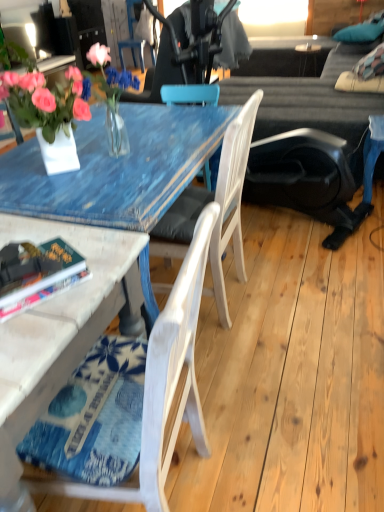
Question: From a real-world perspective, is dark gray fabric couch at upper right positioned above or below translucent glass vase at upper left?

Choices:
 (A) below
 (B) above

Answer: (A)

Question: Does point (292, 87) appear closer or farther from the camera than point (102, 82)?

Choices:
 (A) closer
 (B) farther

Answer: (B)

Question: Estimate the real-world distances between objects in this image. Which object is farther from the matte white side table at lower right?

Choices:
 (A) teal fabric pillow at upper right
 (B) white wood chair at center, which is the 2th chair from bottom to top
 (C) hardcover book at lower left
 (D) white wood chair at lower left, placed as the third chair when sorted from back to front
 (E) wooden chair at upper center, placed as the third chair when sorted from front to back

Answer: (D)

Question: Based on their relative distances, which object is farther from the white wood chair at lower left, placed as the third chair when sorted from back to front?

Choices:
 (A) wooden chair at upper center, placed as the third chair when sorted from front to back
 (B) hardcover book at lower left
 (C) white wood chair at center, which is counted as the 2th chair, starting from the back
 (D) matte white side table at lower right
 (E) dark gray fabric couch at upper right

Answer: (D)